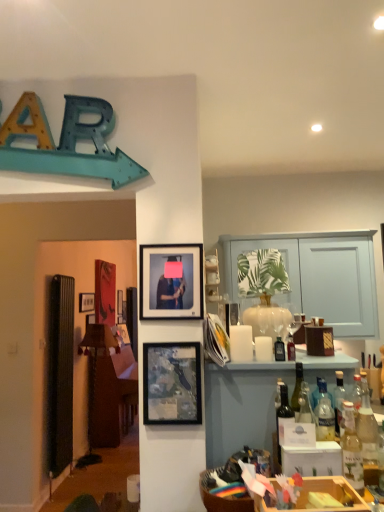
Question: Is wooden crate at lower right bigger than matte glass bottle at center, which is counted as the 1th bottle, starting from the back?

Choices:
 (A) yes
 (B) no

Answer: (A)

Question: From a real-world perspective, is wooden crate at lower right positioned under matte glass bottle at center, which is counted as the fifth bottle, starting from the front, based on gravity?

Choices:
 (A) yes
 (B) no

Answer: (A)

Question: From the image's perspective, is wooden crate at lower right under matte glass bottle at center, which is the second bottle from left to right?

Choices:
 (A) yes
 (B) no

Answer: (A)

Question: Is wooden crate at lower right thinner than matte glass bottle at center, which is counted as the 1th bottle, starting from the back?

Choices:
 (A) no
 (B) yes

Answer: (A)

Question: Can you confirm if wooden crate at lower right is taller than matte glass bottle at center, which is counted as the 1th bottle, starting from the back?

Choices:
 (A) yes
 (B) no

Answer: (A)

Question: Is matte glass bottle at center, which is the second bottle from left to right, located within wooden crate at lower right?

Choices:
 (A) yes
 (B) no

Answer: (B)

Question: Is clear glass bottle at right, placed as the 3th bottle when sorted from front to back, facing away from translucent glass bottle at right, which is the 1th bottle from front to back?

Choices:
 (A) yes
 (B) no

Answer: (B)

Question: Does clear glass bottle at right, the fifth bottle positioned from the left, have a greater height compared to translucent glass bottle at right, the fourth bottle from the left?

Choices:
 (A) yes
 (B) no

Answer: (B)

Question: Is clear glass bottle at right, the 3th bottle viewed from the back, next to translucent glass bottle at right, the fourth bottle from the left?

Choices:
 (A) no
 (B) yes

Answer: (B)

Question: From a real-world perspective, is clear glass bottle at right, the first bottle positioned from the right, under translucent glass bottle at right, which is the 1th bottle from front to back?

Choices:
 (A) no
 (B) yes

Answer: (A)

Question: Does clear glass bottle at right, placed as the 3th bottle when sorted from front to back, appear on the right side of translucent glass bottle at right, the fourth bottle from the left?

Choices:
 (A) yes
 (B) no

Answer: (A)

Question: Is clear glass bottle at right, the 3th bottle viewed from the back, to the left of translucent glass bottle at right, the fourth bottle from the left, from the viewer's perspective?

Choices:
 (A) yes
 (B) no

Answer: (B)

Question: Can you see translucent glass bottles at right touching translucent glass bottle at right, the 2th bottle from the front?

Choices:
 (A) yes
 (B) no

Answer: (B)